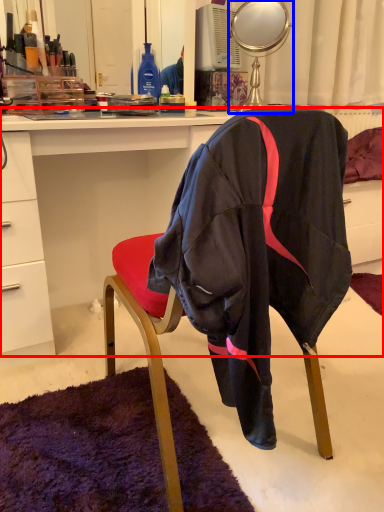
Question: Which object appears closest to the camera in this image, desk (highlighted by a red box) or mirror (highlighted by a blue box)?

Choices:
 (A) desk
 (B) mirror

Answer: (A)